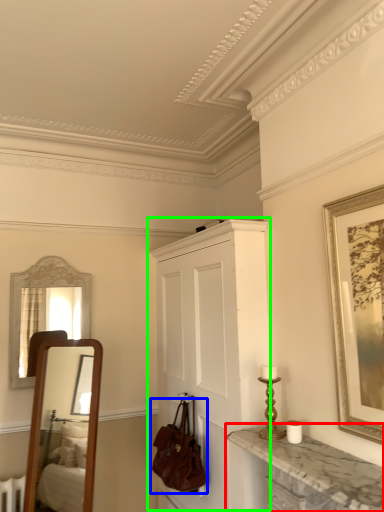
Question: Which object is the closest to the countertop (highlighted by a red box)? Choose among these: handbag (highlighted by a blue box) or cabinetry (highlighted by a green box).

Choices:
 (A) handbag
 (B) cabinetry

Answer: (B)